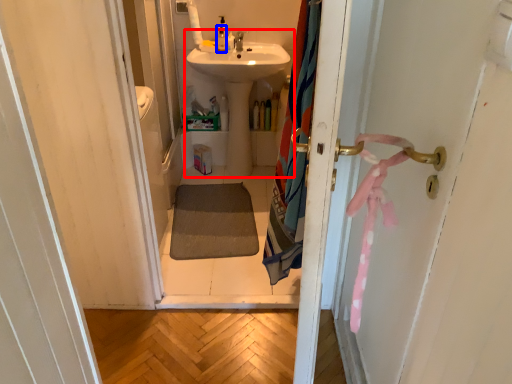
Question: Which of the following is the closest to the observer, sink (highlighted by a red box) or toiletry (highlighted by a blue box)?

Choices:
 (A) sink
 (B) toiletry

Answer: (A)